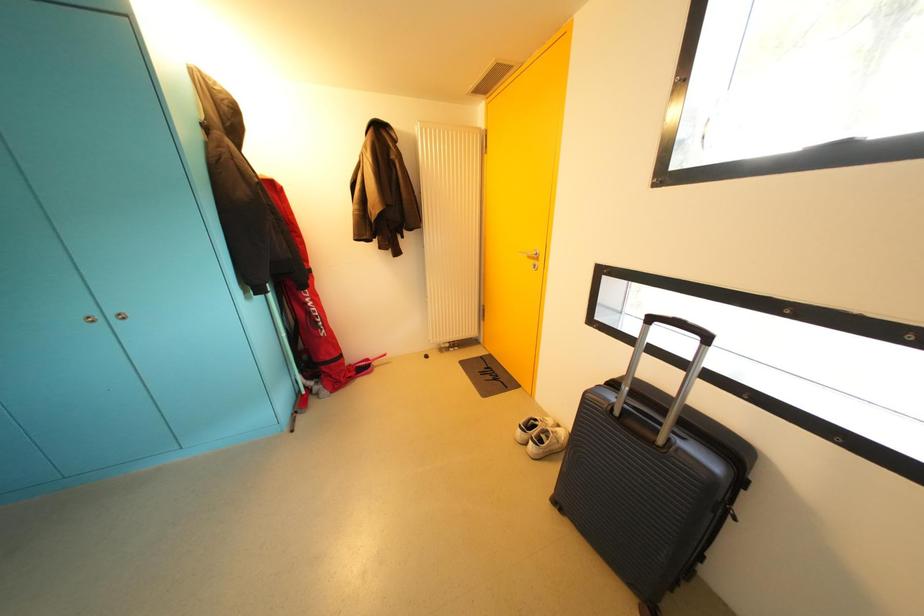
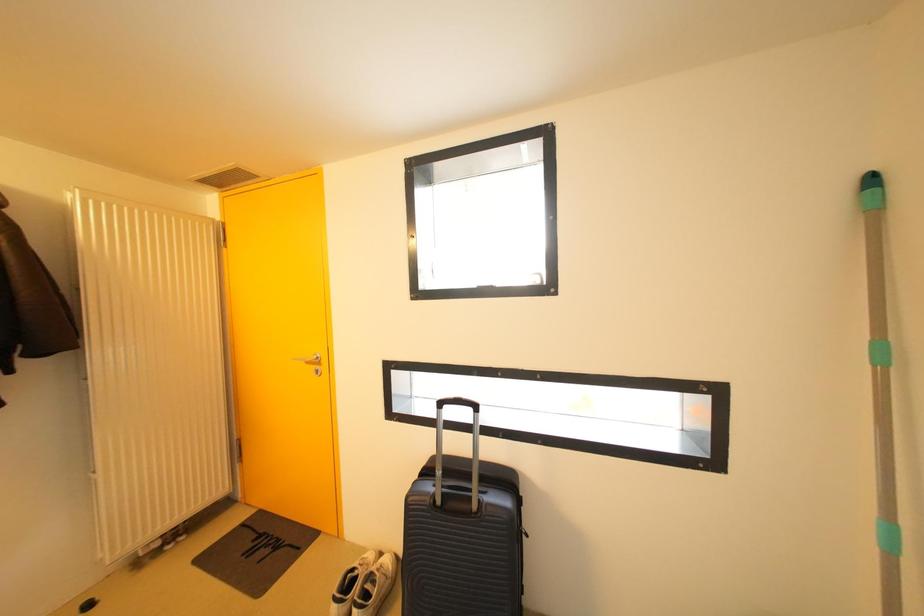
Question: The images are taken continuously from a first-person perspective. In which direction is your viewpoint rotating?

Choices:
 (A) Left
 (B) Right
 (C) Up
 (D) Down

Answer: (B)